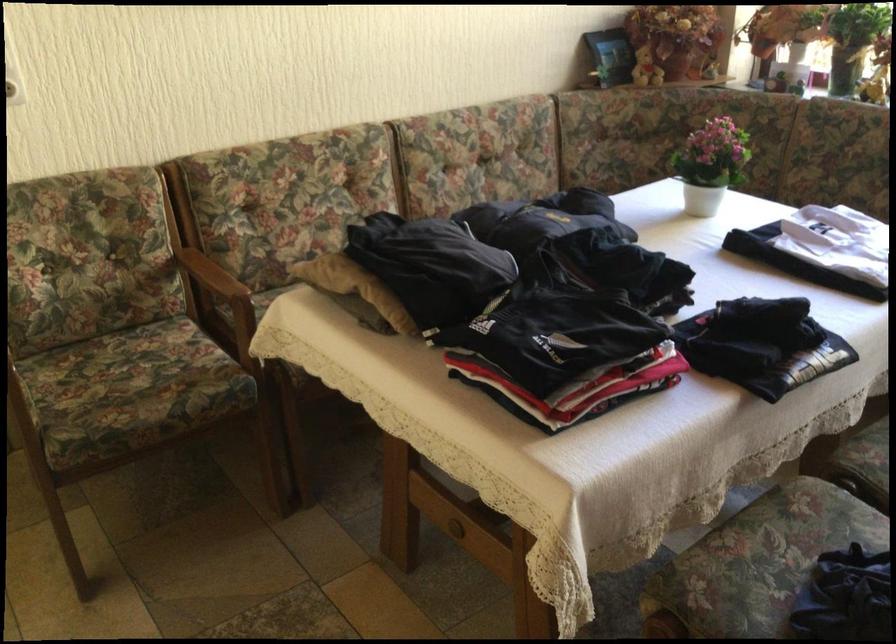
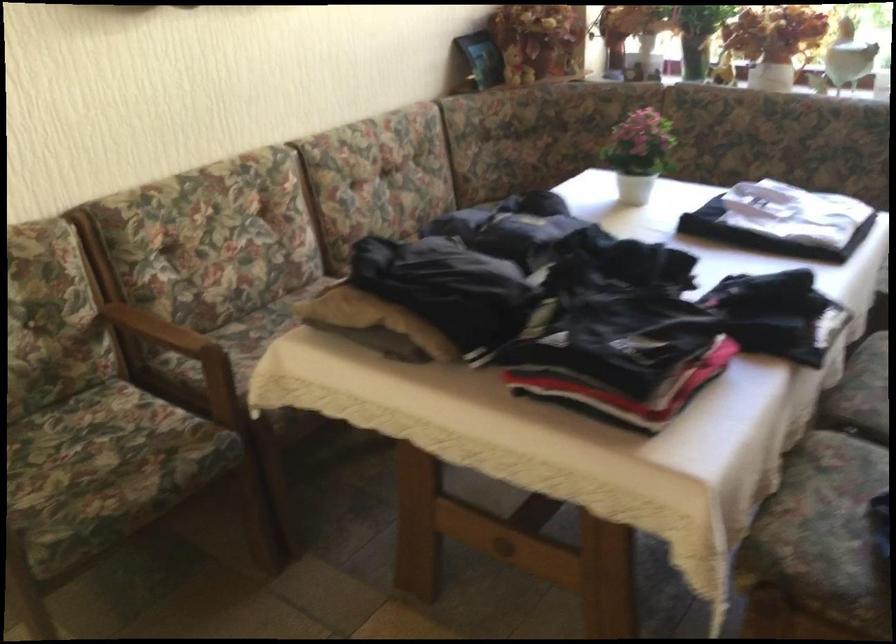
Find the pixel in the second image that matches [209,275] in the first image.

(158, 328)